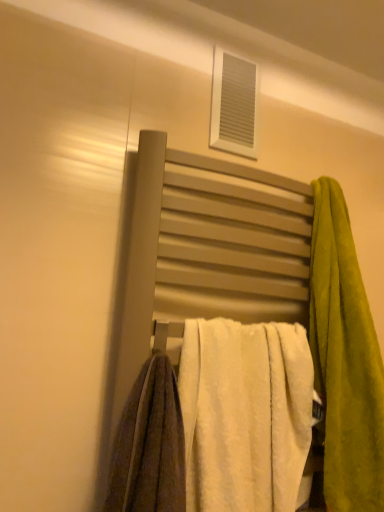
Question: Is white plastic vent at upper center not within green plush towel at right, the first towel from the right?

Choices:
 (A) yes
 (B) no

Answer: (A)

Question: Can green plush towel at right, the first towel from the right, be found inside white plastic vent at upper center?

Choices:
 (A) yes
 (B) no

Answer: (B)

Question: Is the position of white plastic vent at upper center more distant than that of green plush towel at right, which is the 2th towel in left-to-right order?

Choices:
 (A) yes
 (B) no

Answer: (A)

Question: Can you confirm if white plastic vent at upper center is wider than green plush towel at right, the first towel from the right?

Choices:
 (A) no
 (B) yes

Answer: (A)

Question: From the image's perspective, is white plastic vent at upper center below green plush towel at right, the first towel from the right?

Choices:
 (A) no
 (B) yes

Answer: (A)

Question: From a real-world perspective, is white plastic vent at upper center under green plush towel at right, the first towel from the right?

Choices:
 (A) no
 (B) yes

Answer: (A)

Question: From the image's perspective, would you say white plastic vent at upper center is shown under white fluffy towel at center, the 1th towel when ordered from left to right?

Choices:
 (A) yes
 (B) no

Answer: (B)

Question: Can you confirm if white plastic vent at upper center is wider than white fluffy towel at center, the second towel viewed from the right?

Choices:
 (A) no
 (B) yes

Answer: (A)

Question: Can you confirm if white plastic vent at upper center is taller than white fluffy towel at center, the 1th towel when ordered from left to right?

Choices:
 (A) yes
 (B) no

Answer: (B)

Question: Can you confirm if white plastic vent at upper center is bigger than white fluffy towel at center, the second towel viewed from the right?

Choices:
 (A) no
 (B) yes

Answer: (A)

Question: From the image's perspective, does white plastic vent at upper center appear higher than white fluffy towel at center, the 1th towel when ordered from left to right?

Choices:
 (A) yes
 (B) no

Answer: (A)

Question: Is white plastic vent at upper center facing towards white fluffy towel at center, the second towel viewed from the right?

Choices:
 (A) no
 (B) yes

Answer: (A)

Question: Is green plush towel at right, which is the 2th towel in left-to-right order, to the left of matte gray towel rack at center from the viewer's perspective?

Choices:
 (A) yes
 (B) no

Answer: (B)